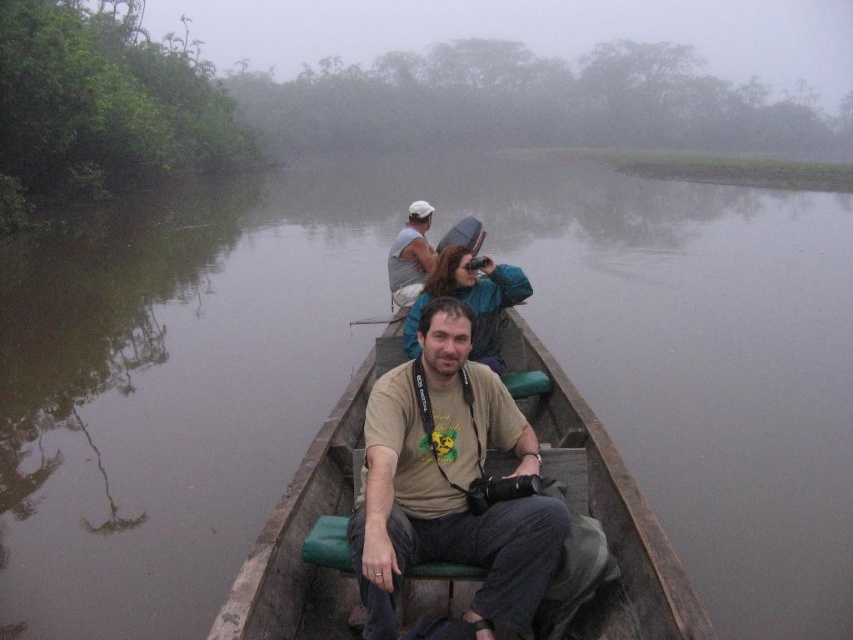
You are standing on the bank of the river and want to take a photo of the wooden canoe at center and the matte brown shirt at center. Which object should you zoom in on to capture both in the frame without moving the camera?

You should zoom in on the matte brown shirt at center because it is smaller than the wooden canoe at center, allowing both to fit within the camera frame when zoomed appropriately.

You are a photographer on the boat and want to capture both the matte brown shirt at center and the matte gray shirt at upper center in a single frame. Which shirt should you focus on to ensure both are in the frame?

The matte brown shirt at center is larger in size than the matte gray shirt at upper center, so focusing on the matte brown shirt at center will help ensure both are in the frame since it occupies more space and can serve as a central point of reference.